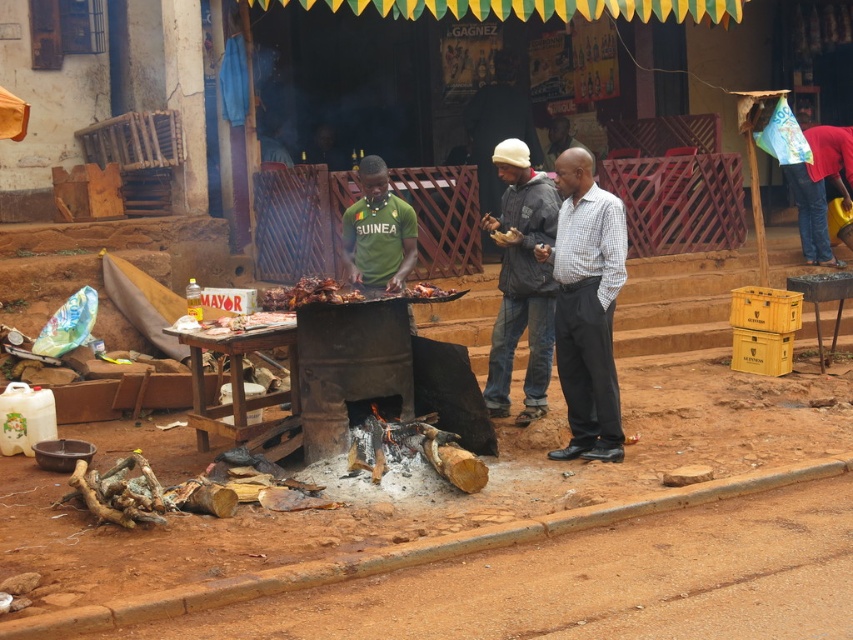
Question: Considering the real-world distances, which object is closest to the white checkered shirt at center?

Choices:
 (A) green matte shirt at center
 (B) brown crispy meat at center

Answer: (A)

Question: Can you confirm if gray woolen jacket at center is thinner than green matte shirt at center?

Choices:
 (A) no
 (B) yes

Answer: (B)

Question: Which point is farther to the camera?

Choices:
 (A) green matte shirt at center
 (B) brown crispy meat at center
 (C) white checkered shirt at center

Answer: (A)

Question: Does green matte shirt at center have a lesser width compared to brown crispy meat at center?

Choices:
 (A) yes
 (B) no

Answer: (A)

Question: Considering the relative positions of white checkered shirt at center and green matte shirt at center in the image provided, where is white checkered shirt at center located with respect to green matte shirt at center?

Choices:
 (A) above
 (B) below

Answer: (B)

Question: Which of the following is the closest to the observer?

Choices:
 (A) gray woolen jacket at center
 (B) brown crispy meat at center
 (C) white checkered shirt at center
 (D) green matte shirt at center

Answer: (B)